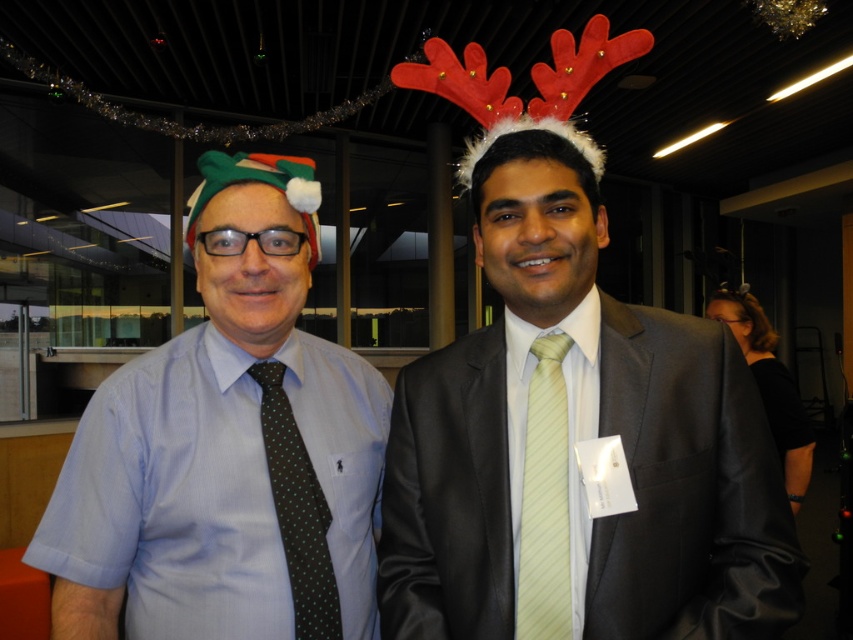
In the scene shown: Which is above, light yellow striped tie at center or dark green dotted tie at left?

light yellow striped tie at center is higher up.

You are a GUI agent. You are given a task and a screenshot of the screen. Output one action in this format:
    pyautogui.click(x=<x>, y=<y>)
    Task: Click on the light yellow striped tie at center
    The height and width of the screenshot is (640, 853).
    Given the screenshot: What is the action you would take?
    pyautogui.click(x=544, y=500)

At what (x,y) coordinates should I click in order to perform the action: click on light yellow striped tie at center. Please return your answer as a coordinate pair (x, y). This screenshot has width=853, height=640. Looking at the image, I should click on (544, 500).

Is matte green tie at left to the left of dark green dotted tie at left from the viewer's perspective?

Correct, you'll find matte green tie at left to the left of dark green dotted tie at left.

In the scene shown: Is matte green tie at left bigger than dark green dotted tie at left?

Indeed, matte green tie at left has a larger size compared to dark green dotted tie at left.

Which is behind, point (207, 355) or point (318, 552)?

The point (207, 355) is behind.

Where is `matte green tie at left`? The image size is (853, 640). matte green tie at left is located at coordinates (227, 448).

Describe the element at coordinates (579, 438) in the screenshot. I see `matte black suit at center` at that location.

Does point (498, 426) come farther from viewer compared to point (318, 516)?

No, (498, 426) is in front of (318, 516).

The width and height of the screenshot is (853, 640). I want to click on matte black suit at center, so click(x=579, y=438).

At what (x,y) coordinates should I click in order to perform the action: click on matte black suit at center. Please return your answer as a coordinate pair (x, y). Looking at the image, I should click on (579, 438).